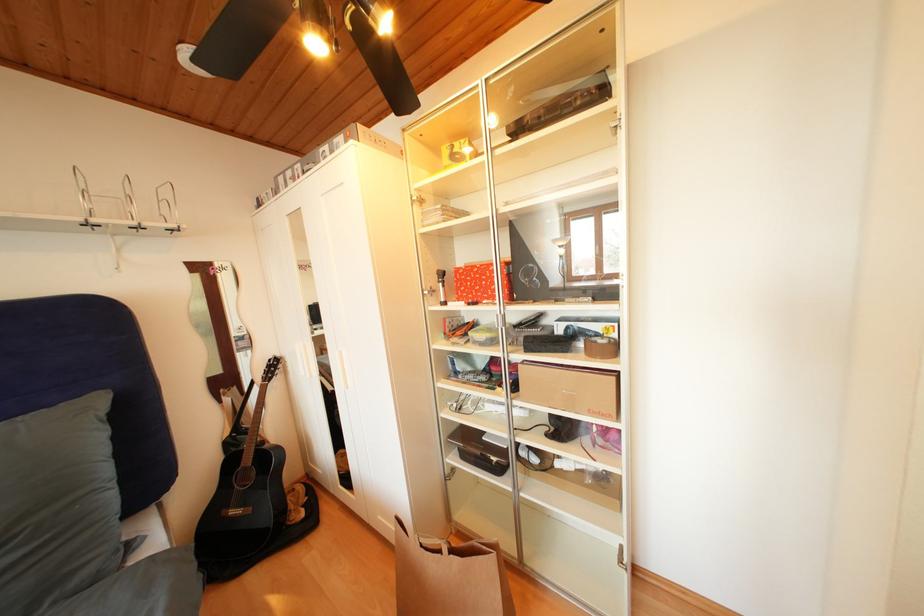
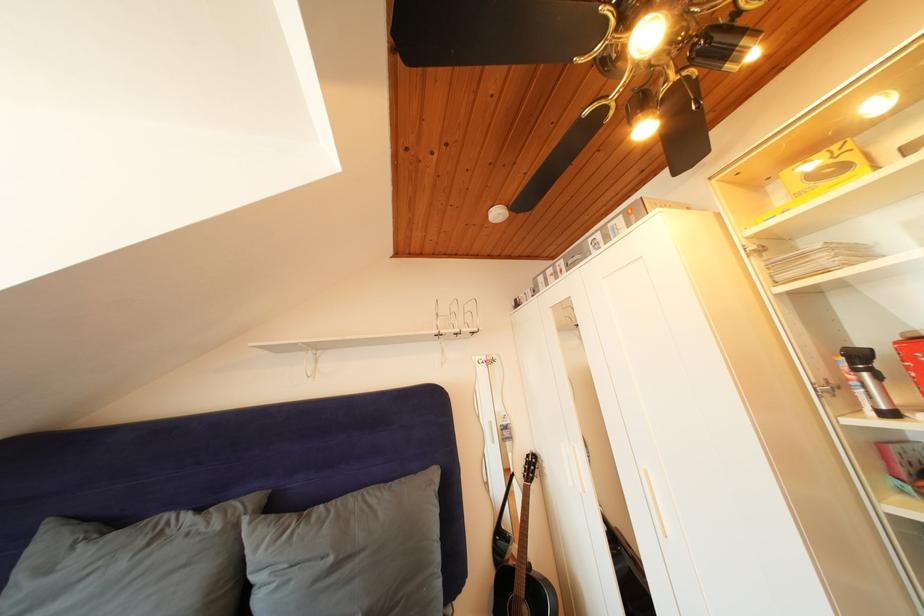
Where in the second image is the point corresponding to (441,297) from the first image?

(844, 392)